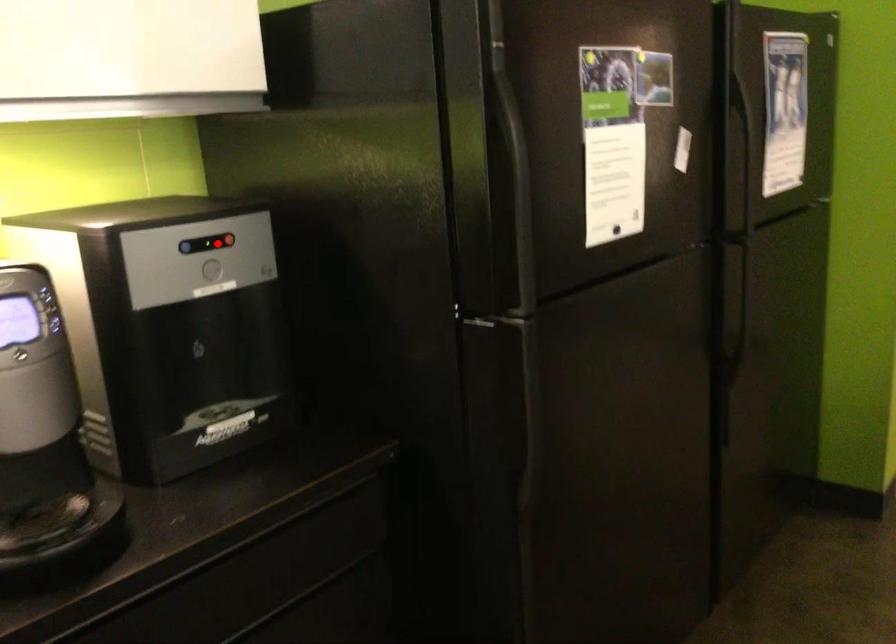
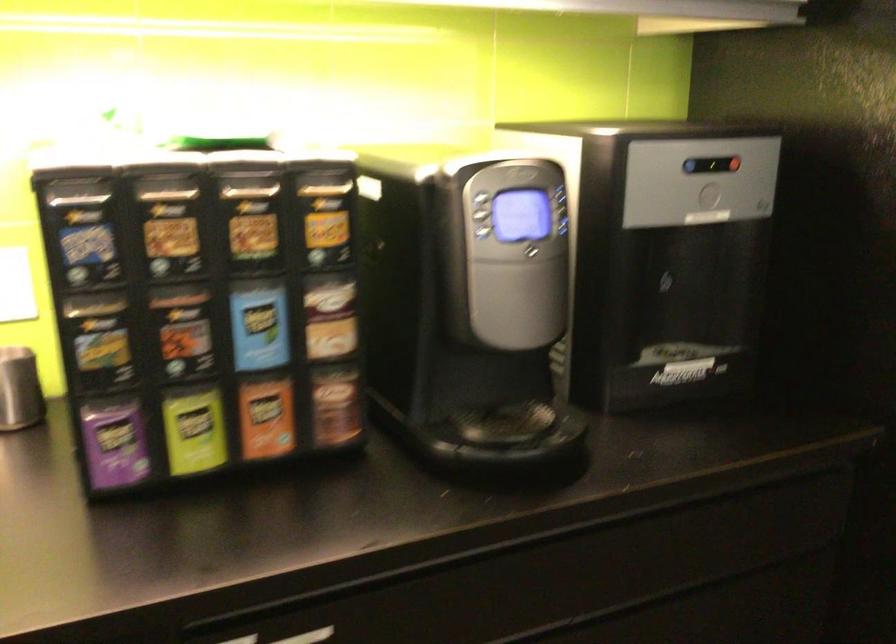
Question: I am providing you with two images of the same scene from different viewpoints. A red point is shown in image1. For the corresponding object point in image2, is it positioned nearer or farther from the camera?

Choices:
 (A) Nearer
 (B) Farther

Answer: (A)